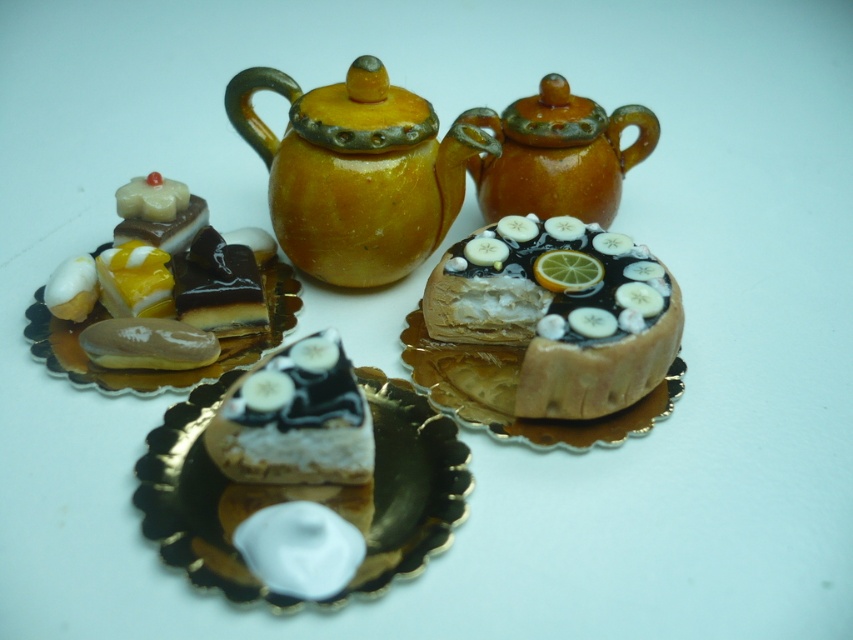
Between glossy ceramic teapot at upper center and semi-glossy chocolate bar at left, which one is positioned higher?

glossy ceramic teapot at upper center is higher up.

Is glossy ceramic teapot at upper center to the right of semi-glossy chocolate bar at left from the viewer's perspective?

Correct, you'll find glossy ceramic teapot at upper center to the right of semi-glossy chocolate bar at left.

Between point (363, 104) and point (180, 182), which one is positioned behind?

The point (180, 182) is behind.

This screenshot has width=853, height=640. In order to click on glossy ceramic teapot at upper center in this screenshot , I will do `click(357, 172)`.

Does white glossy cake at center have a lesser width compared to semi-glossy chocolate bar at left?

In fact, white glossy cake at center might be wider than semi-glossy chocolate bar at left.

Is white glossy cake at center further to the viewer compared to semi-glossy chocolate bar at left?

No, it is in front of semi-glossy chocolate bar at left.

Does point (354, 486) lie in front of point (144, 234)?

Yes.

Locate an element on the screen. white glossy cake at center is located at coordinates (306, 493).

Who is more forward, (396, 92) or (480, 112)?

Point (396, 92)

Who is positioned more to the left, glossy ceramic teapot at upper center or matte orange teapot at upper center?

From the viewer's perspective, glossy ceramic teapot at upper center appears more on the left side.

This screenshot has height=640, width=853. I want to click on glossy ceramic teapot at upper center, so click(x=357, y=172).

Locate an element on the screen. This screenshot has width=853, height=640. glossy ceramic teapot at upper center is located at coordinates (357, 172).